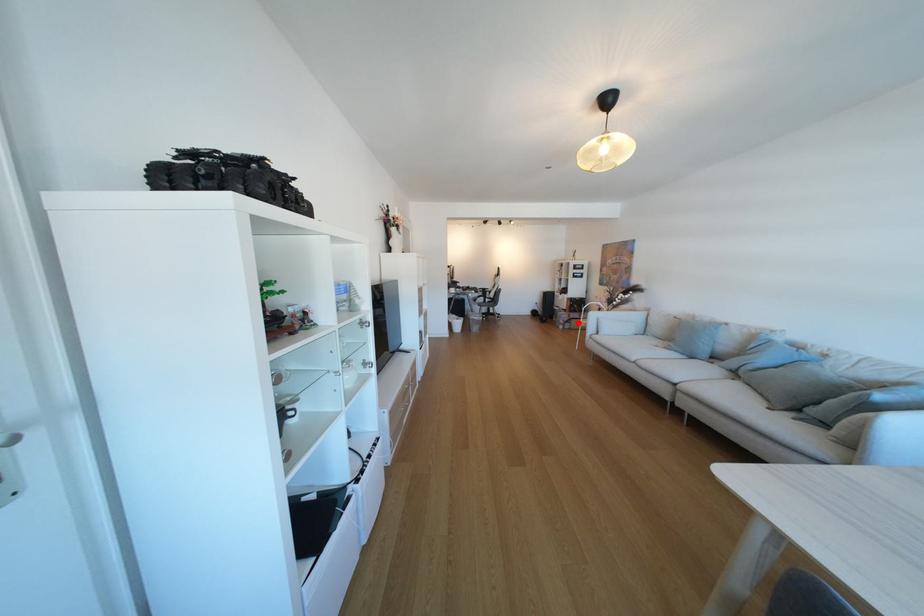
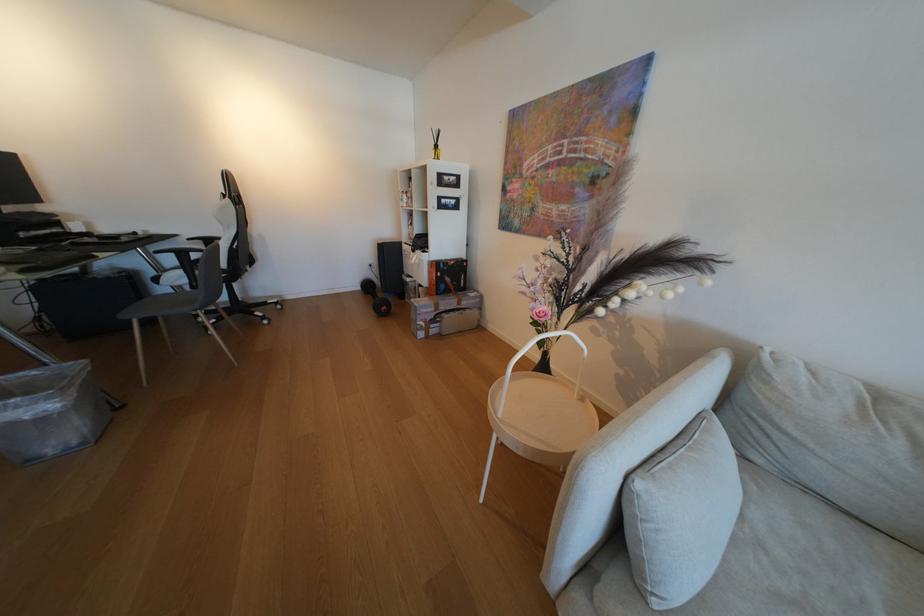
Question: A red point is marked in image1. In image2, is the corresponding 3D point closer to the camera or farther? Reply with the corresponding letter.

Choices:
 (A) The corresponding 3D point is closer.
 (B) The corresponding 3D point is farther.

Answer: (B)